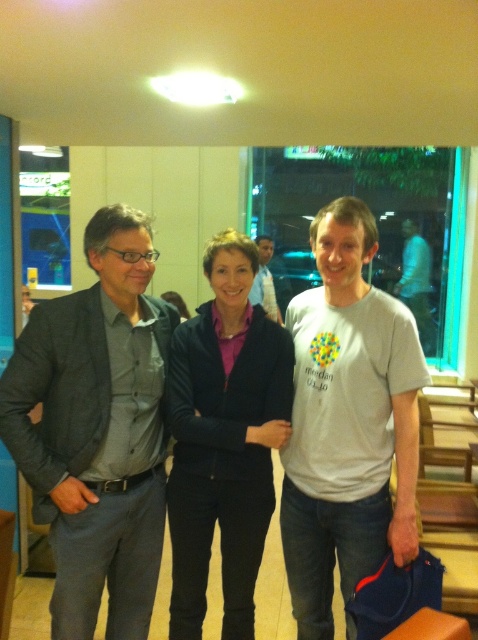
You are a photographer trying to capture a candid shot of the dark gray textured blazer at left. You need to position your camera at point (x=97, y=429). Can you confirm if the dark gray textured blazer at left is located exactly at that coordinate?

Yes, the dark gray textured blazer at left is located exactly at point (x=97, y=429) as stated in the description.